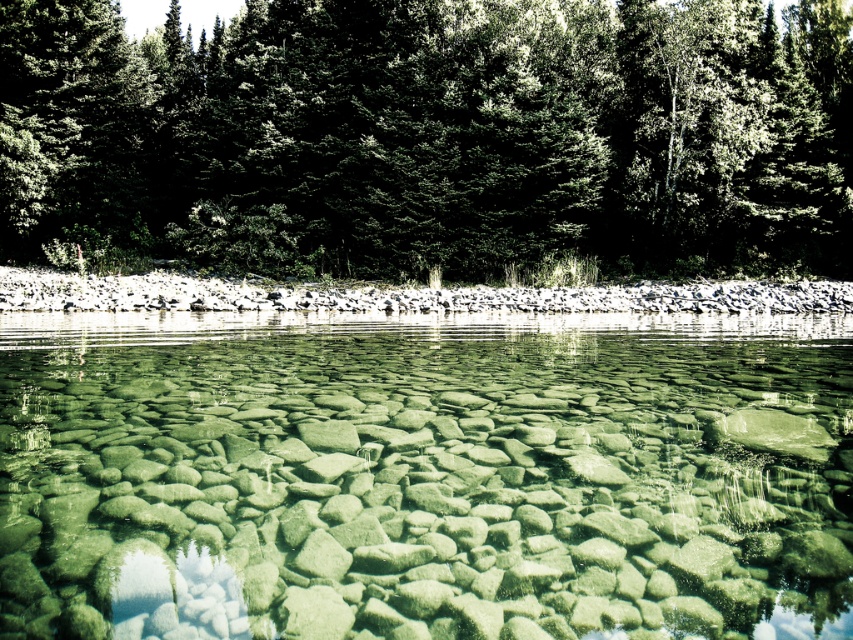
Question: Does green stone river at center appear on the right side of green textured trees at upper center?

Choices:
 (A) no
 (B) yes

Answer: (A)

Question: Does green stone river at center have a larger size compared to green textured trees at upper center?

Choices:
 (A) no
 (B) yes

Answer: (A)

Question: Which of the following is the farthest from the observer?

Choices:
 (A) green textured trees at upper center
 (B) green stone river at center

Answer: (A)

Question: Which of the following is the farthest from the observer?

Choices:
 (A) green stone river at center
 (B) green textured trees at upper center

Answer: (B)

Question: Is green stone river at center thinner than green textured trees at upper center?

Choices:
 (A) no
 (B) yes

Answer: (B)